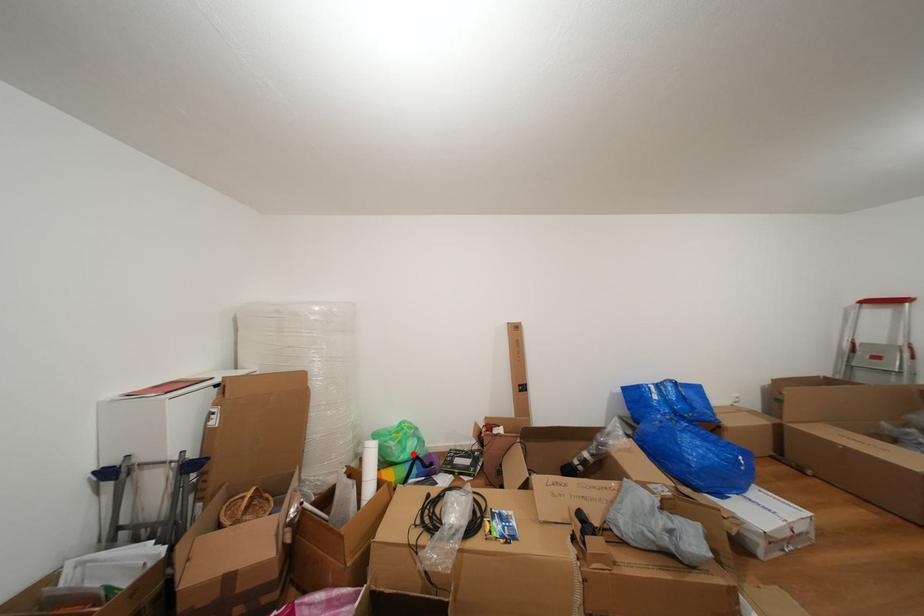
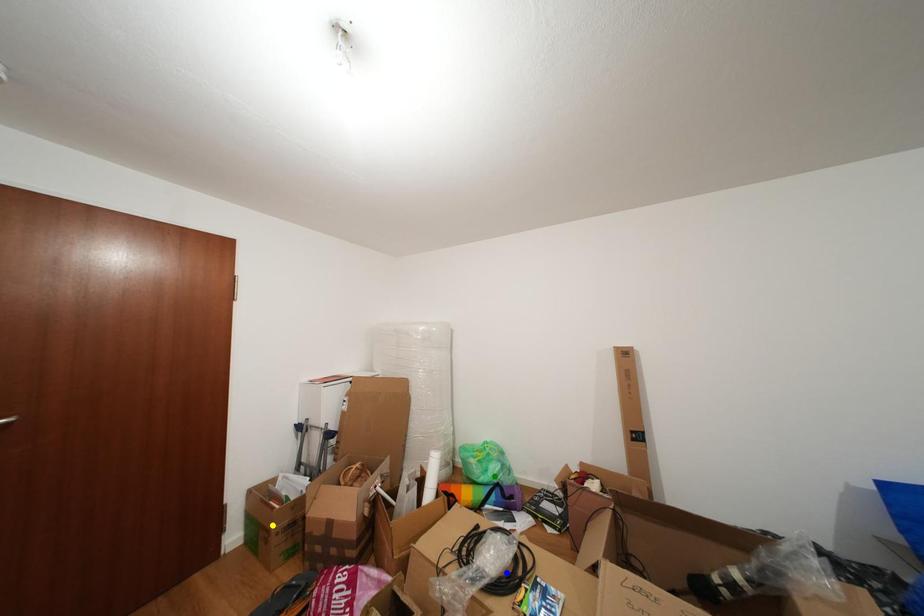
Question: I am providing you with two images of the same scene from different viewpoints. A red point is marked on the first image. You are given multiple points on the second image. Which spot in image 2 lines up with the point in image 1?

Choices:
 (A) blue point
 (B) yellow point
 (C) green point

Answer: (C)